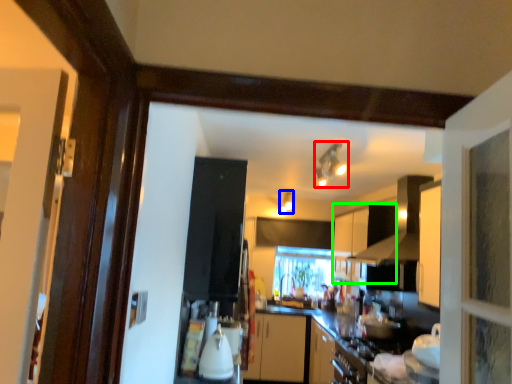
Question: Considering the real-world distances, which object is farthest from light fixture (highlighted by a red box)? light fixture (highlighted by a blue box) or cabinetry (highlighted by a green box)?

Choices:
 (A) light fixture
 (B) cabinetry

Answer: (A)